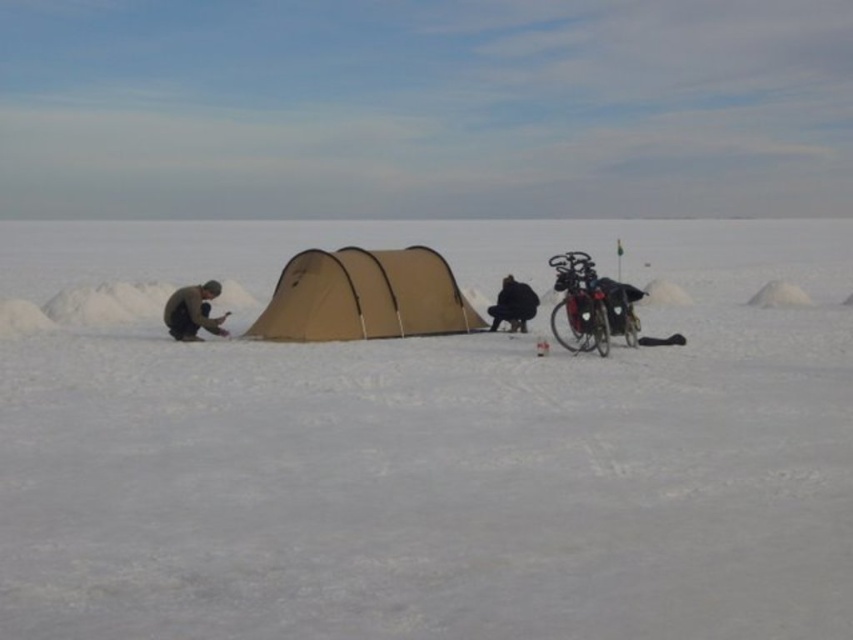
You are setting up a winter campsite and have a white matte snow at center and a brown woolen sweater at left. Which object is positioned to the right of the other?

The white matte snow at center is to the right of the brown woolen sweater at left.

You are planning to set up a tent in a snowy area and want to ensure there is enough space for a person to move around inside. Based on the image, does the tan fabric tent at center provide enough space for the black fabric person at center to stand up comfortably?

The tan fabric tent at center is wider than the black fabric person at center, so it likely provides enough space for the person to stand up comfortably inside.

What is the exact coordinate of the white matte snow at center in the image?

The white matte snow at center is located at point (432, 449).